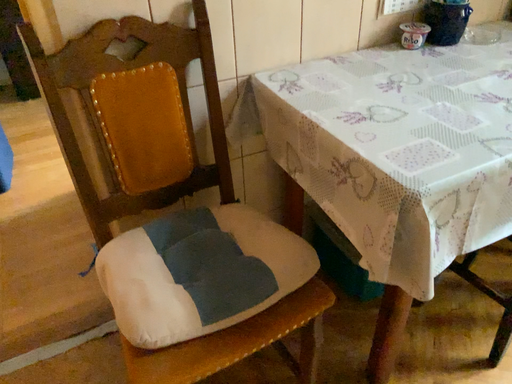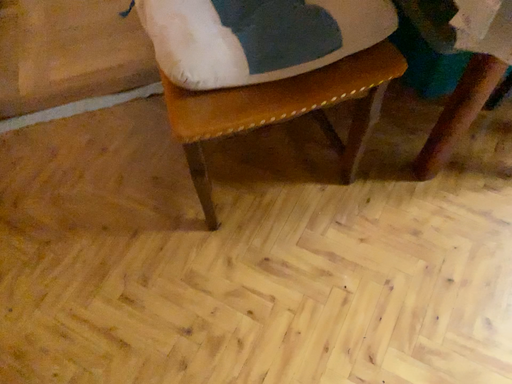
Question: How did the camera likely rotate when shooting the video?

Choices:
 (A) rotated downward
 (B) rotated upward

Answer: (A)